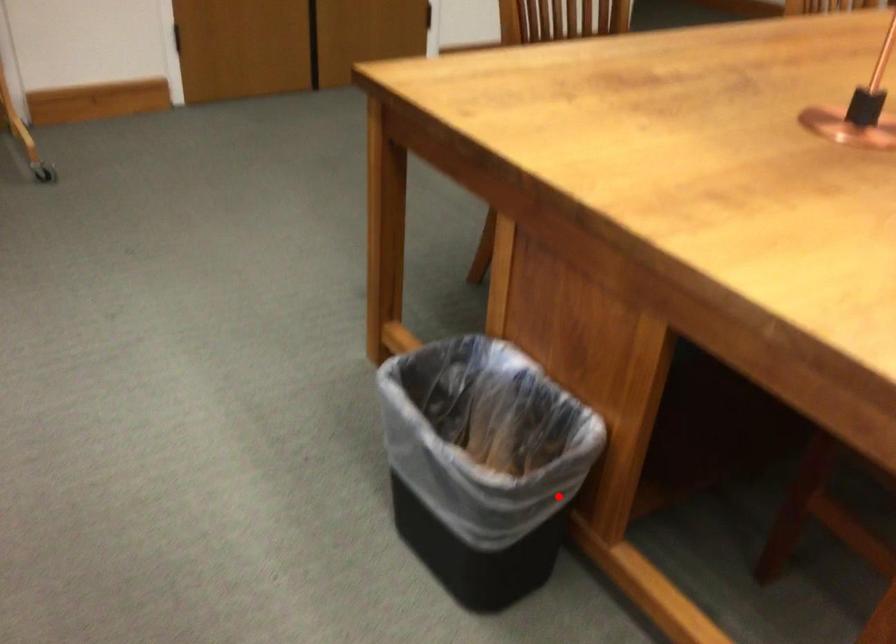
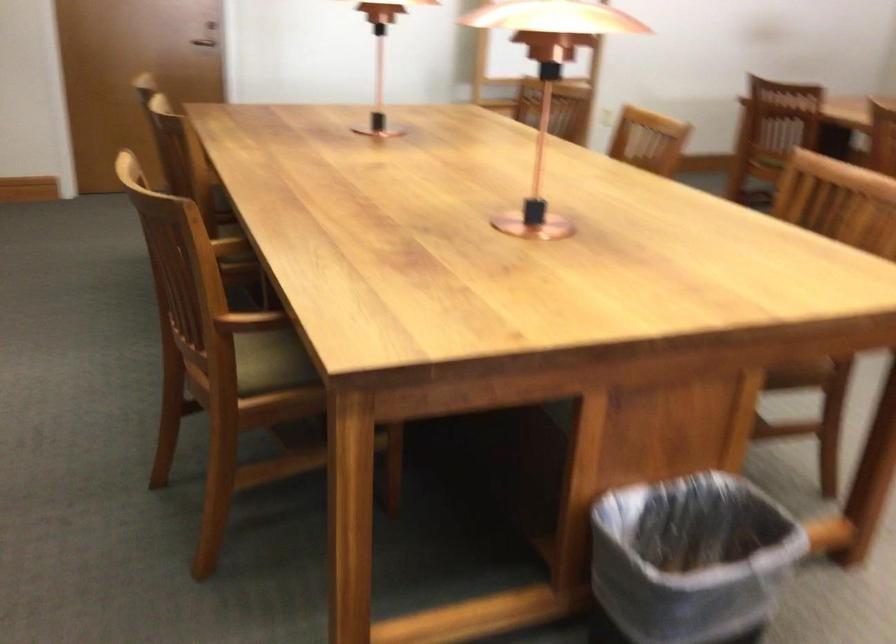
In the second image, find the point that corresponds to the highlighted location in the first image.

(691, 560)